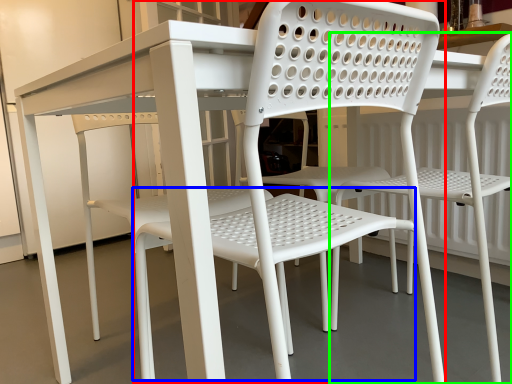
Question: Which object is positioned farthest from chair (highlighted by a red box)? Select from bar stool (highlighted by a blue box) and chair (highlighted by a green box).

Choices:
 (A) bar stool
 (B) chair

Answer: (B)